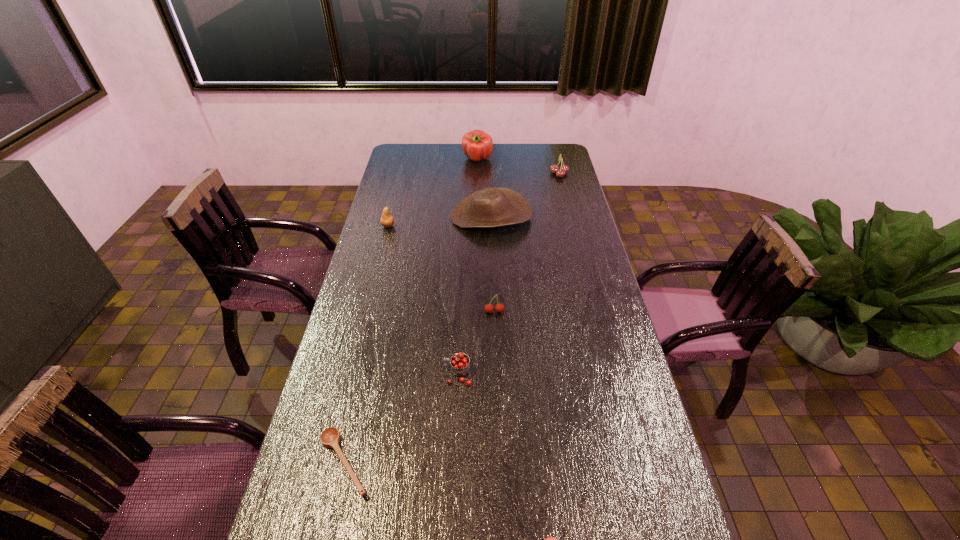
Where is `cherry identified as the second closest to the wooden spoon`? The image size is (960, 540). cherry identified as the second closest to the wooden spoon is located at coordinates (550, 539).

This screenshot has width=960, height=540. I want to click on free point that satisfies the following two spatial constraints: 1. on the handle side of the leftmost cherry; 2. on the right side of the bell pepper, so click(x=467, y=159).

The width and height of the screenshot is (960, 540). What are the coordinates of `free space that satisfies the following two spatial constraints: 1. on the handle side of the tallest object; 2. on the left side of the leftmost cherry` in the screenshot? It's located at (467, 159).